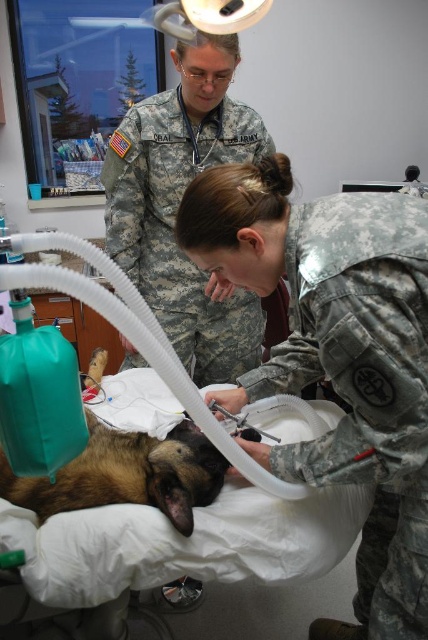
Question: Which point appears farthest from the camera in this image?

Choices:
 (A) (262, 166)
 (B) (193, 465)
 (C) (240, 323)

Answer: (C)

Question: Can you confirm if camouflage fabric uniform at upper center is smaller than brown fur dog at center?

Choices:
 (A) yes
 (B) no

Answer: (B)

Question: Is camouflage uniform at center positioned at the back of brown fur dog at center?

Choices:
 (A) no
 (B) yes

Answer: (A)

Question: Which is nearer to the camouflage fabric uniform at upper center?

Choices:
 (A) brown fur dog at center
 (B) camouflage uniform at center

Answer: (B)

Question: Which object is positioned closest to the brown fur dog at center?

Choices:
 (A) camouflage uniform at center
 (B) camouflage fabric uniform at upper center

Answer: (A)

Question: Does camouflage uniform at center appear over camouflage fabric uniform at upper center?

Choices:
 (A) no
 (B) yes

Answer: (A)